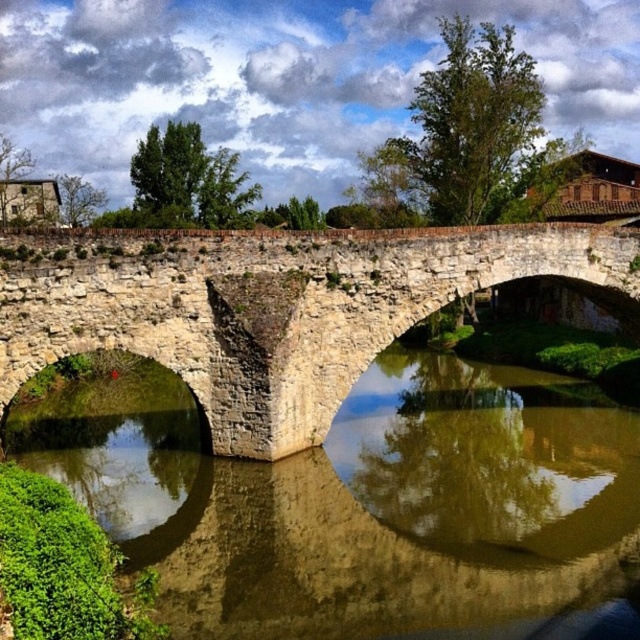
Question: Can you confirm if brown stone water at center is positioned to the right of stone arch bridge at center?

Choices:
 (A) yes
 (B) no

Answer: (B)

Question: Which point appears closest to the camera in this image?

Choices:
 (A) (412, 522)
 (B) (500, 228)

Answer: (A)

Question: Does brown stone water at center appear on the left side of stone arch bridge at center?

Choices:
 (A) yes
 (B) no

Answer: (A)

Question: Is brown stone water at center below stone arch bridge at center?

Choices:
 (A) no
 (B) yes

Answer: (B)

Question: Which point is farther from the camera taking this photo?

Choices:
 (A) (33, 256)
 (B) (538, 410)

Answer: (B)